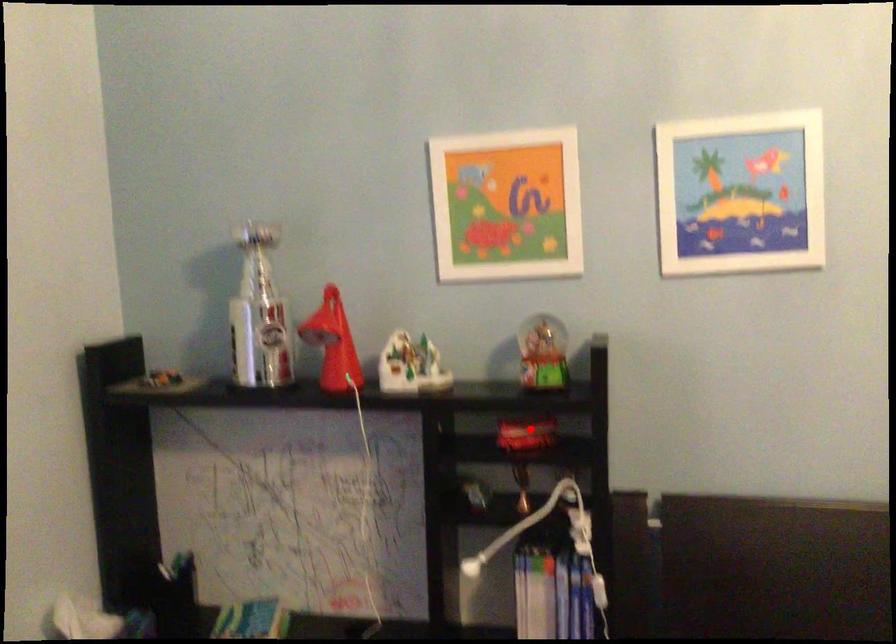
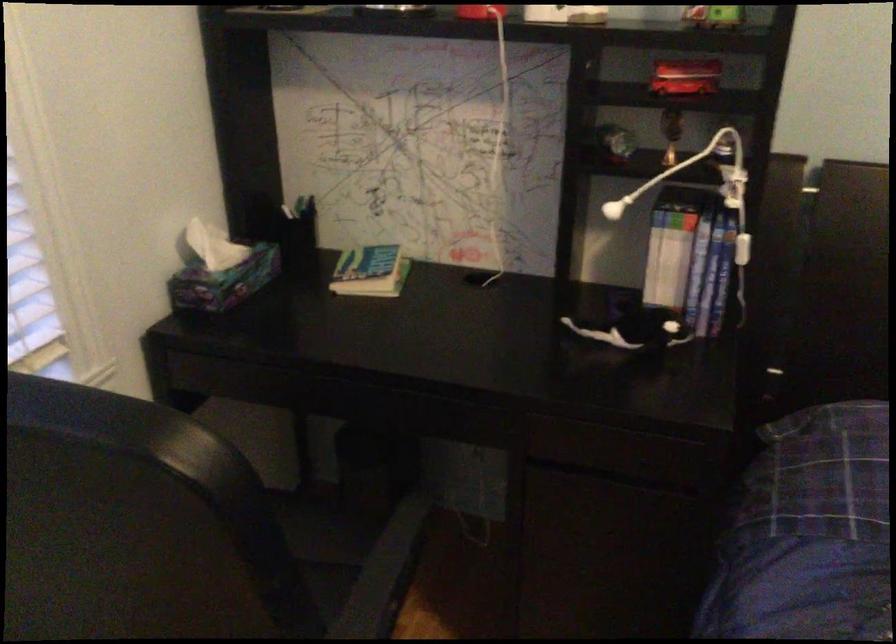
Where in the second image is the point corresponding to the highlighted location from the first image?

(685, 77)